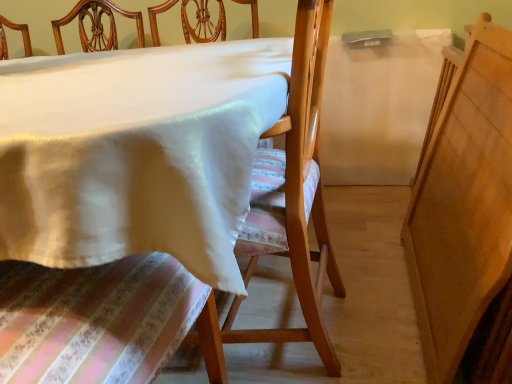
Question: Is wooden chair at center to the left or to the right of white glossy table at center in the image?

Choices:
 (A) right
 (B) left

Answer: (A)

Question: From the image's perspective, is wooden chair at center positioned above or below white glossy table at center?

Choices:
 (A) above
 (B) below

Answer: (A)

Question: Does point (310, 28) appear closer or farther from the camera than point (263, 104)?

Choices:
 (A) closer
 (B) farther

Answer: (B)

Question: Is point (248, 153) closer or farther from the camera than point (242, 337)?

Choices:
 (A) closer
 (B) farther

Answer: (A)

Question: From a real-world perspective, is white glossy table at center physically located above or below wooden chair at center?

Choices:
 (A) below
 (B) above

Answer: (A)

Question: Based on their positions, is white glossy table at center located to the left or right of wooden chair at center?

Choices:
 (A) left
 (B) right

Answer: (A)

Question: In terms of height, does white glossy table at center look taller or shorter compared to wooden chair at center?

Choices:
 (A) short
 (B) tall

Answer: (A)